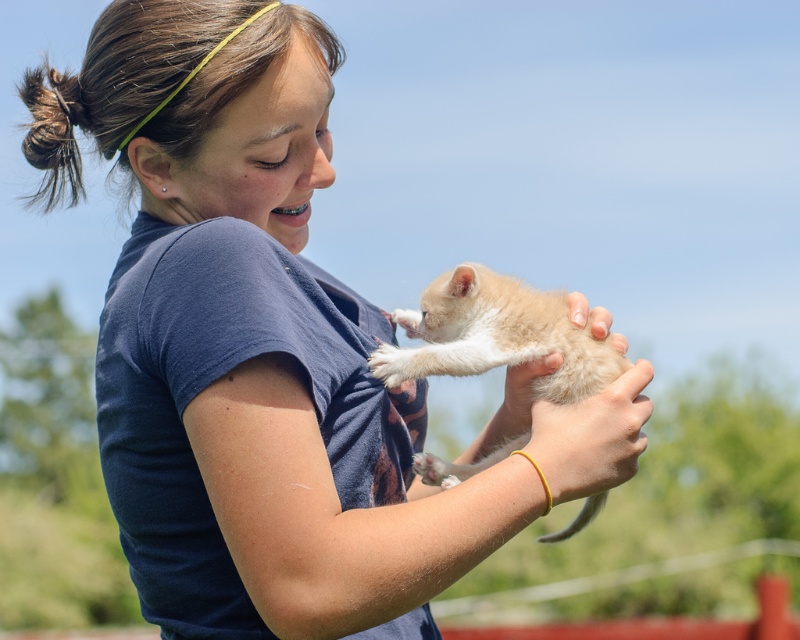
Question: Does fluffy beige cat at center have a greater width compared to smooth skin hand at center?

Choices:
 (A) yes
 (B) no

Answer: (A)

Question: Is fluffy beige cat at center closer to the viewer compared to soft fur paw at center?

Choices:
 (A) no
 (B) yes

Answer: (B)

Question: Among these points, which one is farthest from the camera?

Choices:
 (A) (392, 365)
 (B) (574, 401)
 (C) (518, 397)
 (D) (636, 403)

Answer: (C)

Question: Does smooth skin hand at center have a smaller size compared to white fluffy paw at upper center?

Choices:
 (A) yes
 (B) no

Answer: (B)

Question: Which of the following is the farthest from the observer?

Choices:
 (A) (526, 392)
 (B) (490, 300)
 (C) (406, 376)
 (D) (498, 472)

Answer: (B)

Question: Which point appears farthest from the camera in this image?

Choices:
 (A) (562, 368)
 (B) (386, 342)
 (C) (605, 422)

Answer: (B)